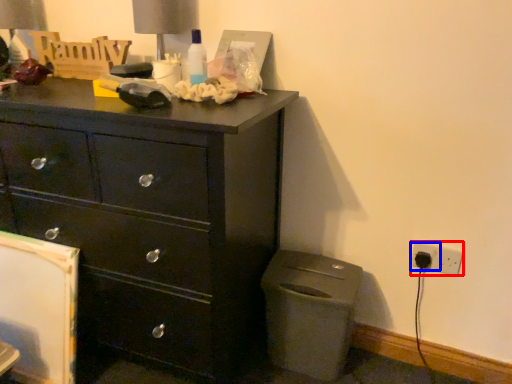
Question: Which object is closer to the camera taking this photo, electric outlet (highlighted by a red box) or electric outlet (highlighted by a blue box)?

Choices:
 (A) electric outlet
 (B) electric outlet

Answer: (A)